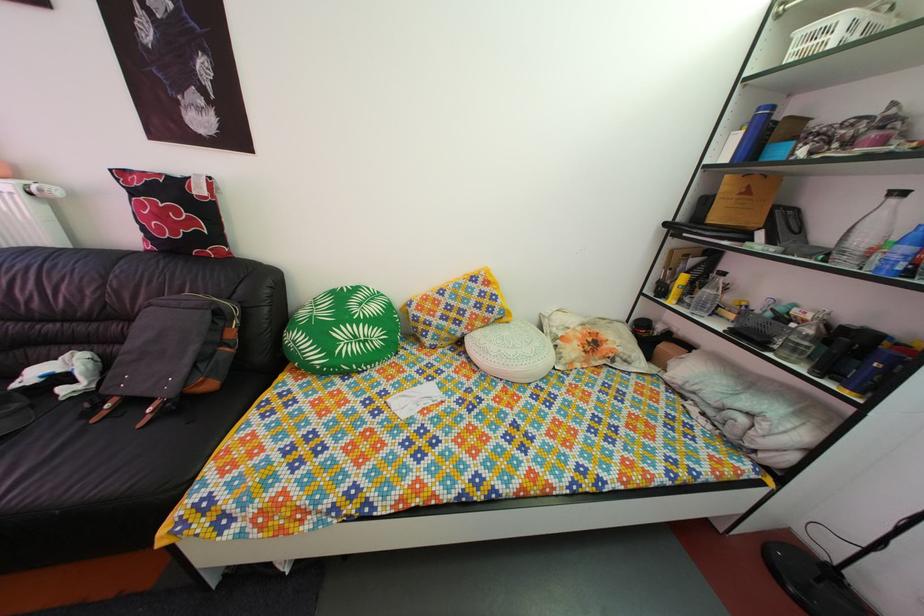
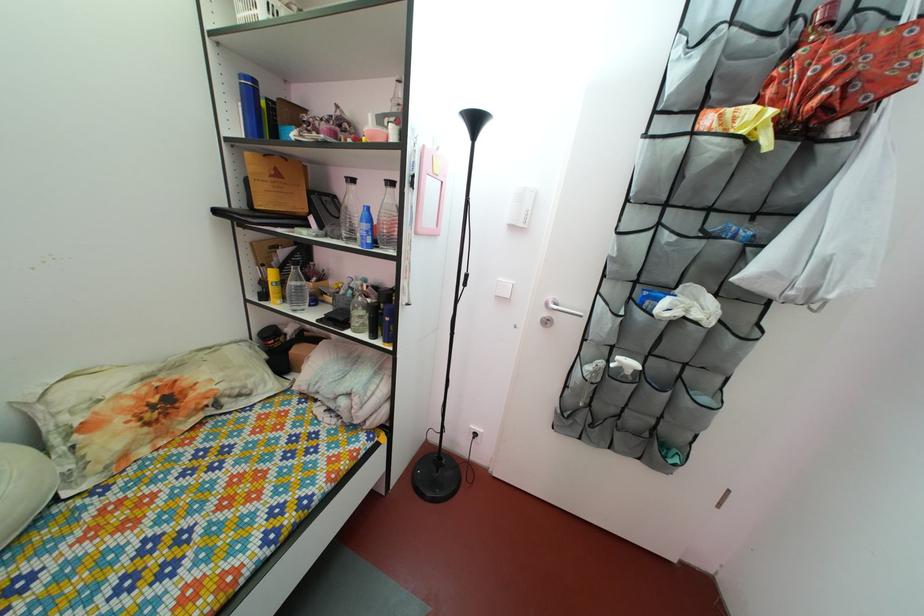
The point at (777,323) is marked in the first image. Where is the corresponding point in the second image?

(359, 301)